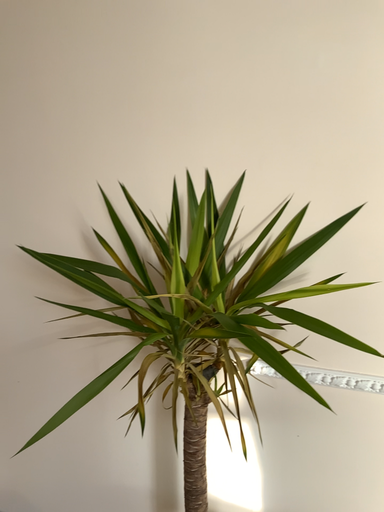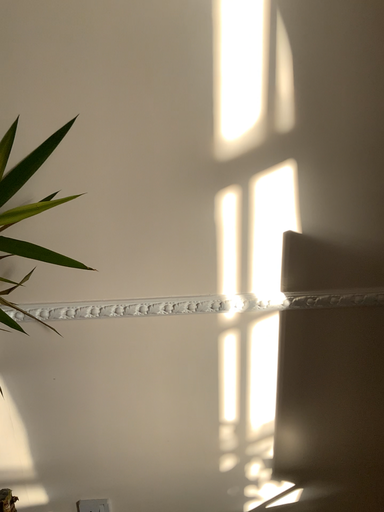
Question: Which way did the camera rotate in the video?

Choices:
 (A) rotated right
 (B) rotated left

Answer: (A)